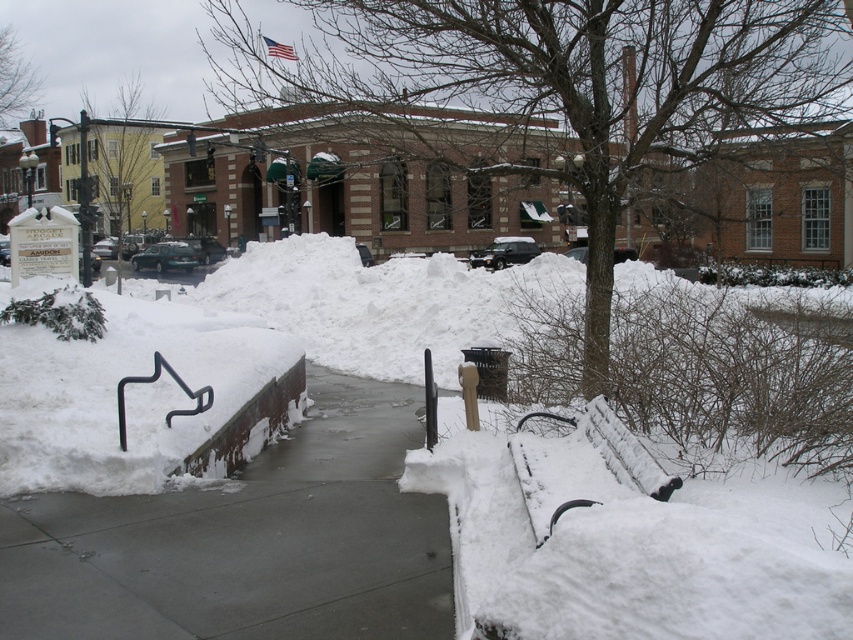
Can you confirm if smooth concrete path at center is positioned below snow-covered wood bench at lower right?

Yes.

Based on the photo, which is above, smooth concrete path at center or snow-covered wood bench at lower right?

Positioned higher is snow-covered wood bench at lower right.

Locate an element on the screen. The image size is (853, 640). smooth concrete path at center is located at coordinates (247, 541).